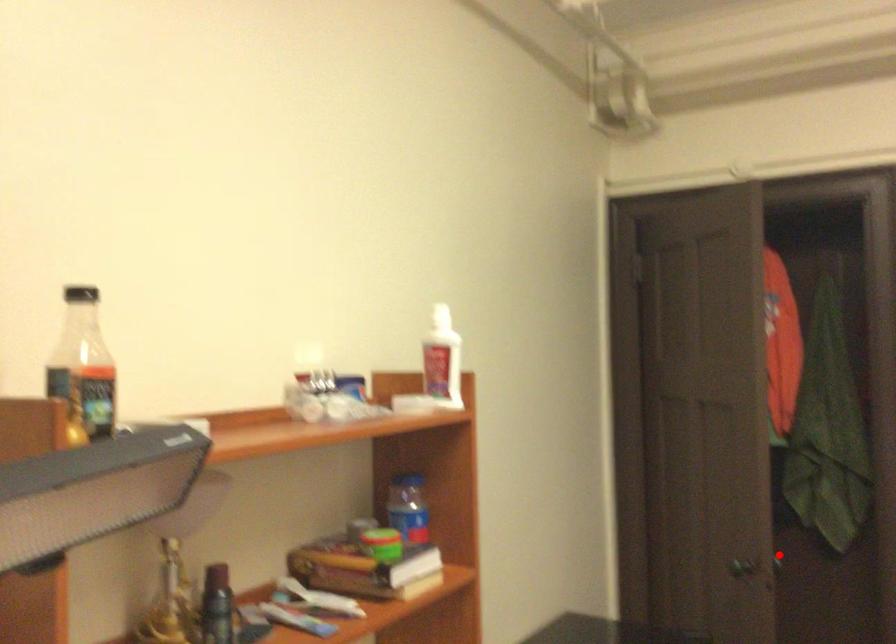
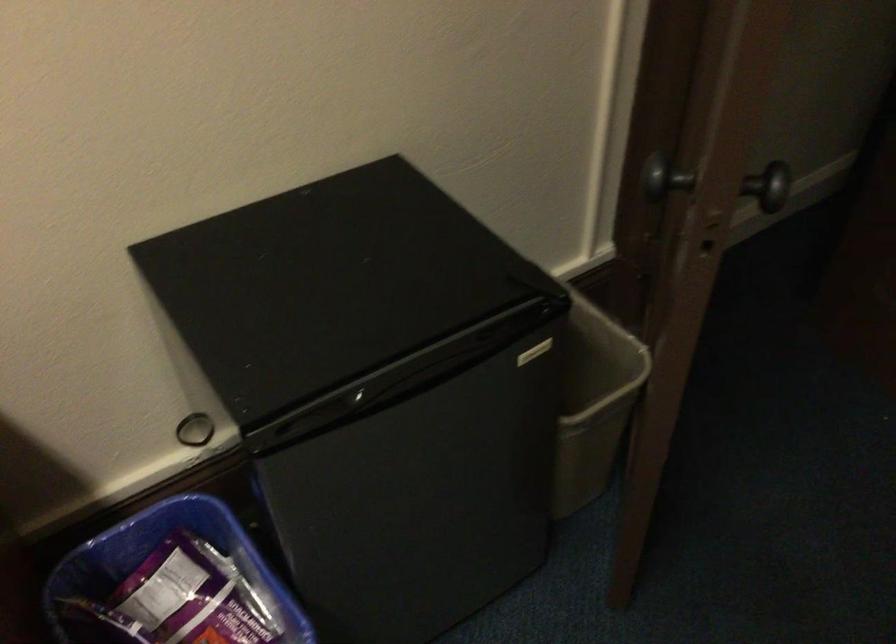
Locate, in the second image, the point that corresponds to the highlighted location in the first image.

(771, 185)